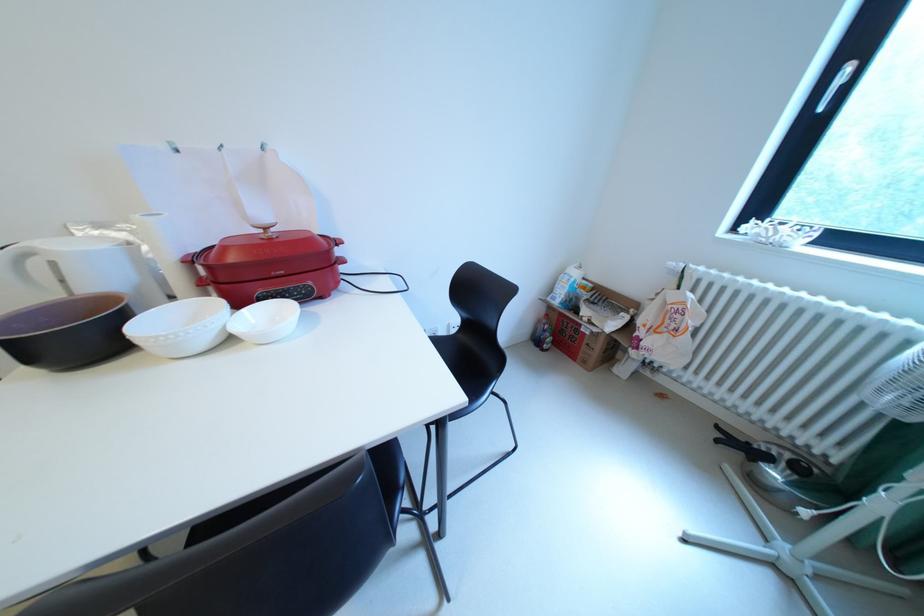
At what (x,y) coordinates should I click in order to perform the action: click on white textured bowl. Please return your answer as a coordinate pair (x, y). This screenshot has width=924, height=616. Looking at the image, I should click on (x=179, y=326).